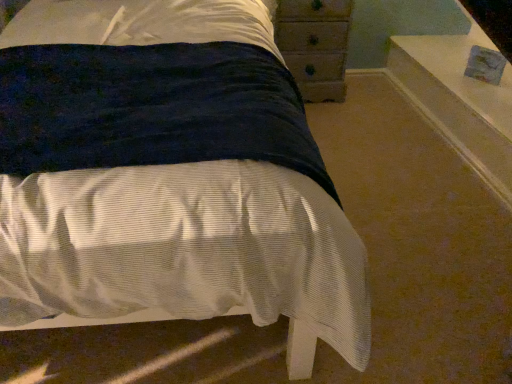
Question: Is velvet dark blue bed at center further to the viewer compared to wooden chest of drawers at upper right?

Choices:
 (A) no
 (B) yes

Answer: (A)

Question: Is velvet dark blue bed at center to the right of wooden chest of drawers at upper right from the viewer's perspective?

Choices:
 (A) yes
 (B) no

Answer: (B)

Question: Is velvet dark blue bed at center located outside wooden chest of drawers at upper right?

Choices:
 (A) yes
 (B) no

Answer: (A)

Question: Is the depth of velvet dark blue bed at center less than that of wooden chest of drawers at upper right?

Choices:
 (A) yes
 (B) no

Answer: (A)

Question: From the image's perspective, is velvet dark blue bed at center over wooden chest of drawers at upper right?

Choices:
 (A) no
 (B) yes

Answer: (A)

Question: From a real-world perspective, is velvet dark blue bed at center above or below white glossy window sill at upper right?

Choices:
 (A) below
 (B) above

Answer: (A)

Question: Is velvet dark blue bed at center bigger or smaller than white glossy window sill at upper right?

Choices:
 (A) big
 (B) small

Answer: (B)

Question: From their relative heights in the image, would you say velvet dark blue bed at center is taller or shorter than white glossy window sill at upper right?

Choices:
 (A) short
 (B) tall

Answer: (A)

Question: Would you say velvet dark blue bed at center is to the left or to the right of white glossy window sill at upper right in the picture?

Choices:
 (A) left
 (B) right

Answer: (A)

Question: Based on their positions, is velvet dark blue bed at center located to the left or right of wooden chest of drawers at upper right?

Choices:
 (A) right
 (B) left

Answer: (B)

Question: In terms of height, does velvet dark blue bed at center look taller or shorter compared to wooden chest of drawers at upper right?

Choices:
 (A) short
 (B) tall

Answer: (A)

Question: Relative to wooden chest of drawers at upper right, is velvet dark blue bed at center in front or behind?

Choices:
 (A) front
 (B) behind

Answer: (A)

Question: From a real-world perspective, is velvet dark blue bed at center positioned above or below wooden chest of drawers at upper right?

Choices:
 (A) below
 (B) above

Answer: (A)

Question: Would you say wooden chest of drawers at upper right is inside or outside velvet dark blue bed at center?

Choices:
 (A) inside
 (B) outside

Answer: (B)

Question: Relative to velvet dark blue bed at center, is wooden chest of drawers at upper right in front or behind?

Choices:
 (A) behind
 (B) front

Answer: (A)